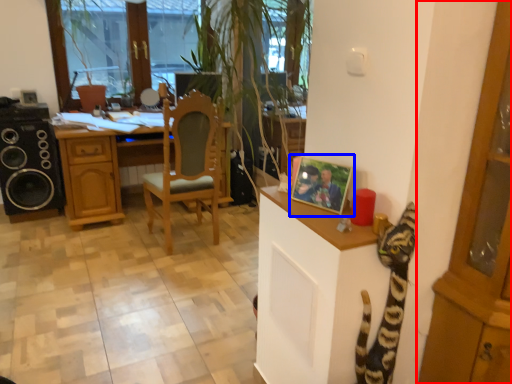
Question: Which point is further to the camera, cabinetry (highlighted by a red box) or picture frame (highlighted by a blue box)?

Choices:
 (A) cabinetry
 (B) picture frame

Answer: (B)